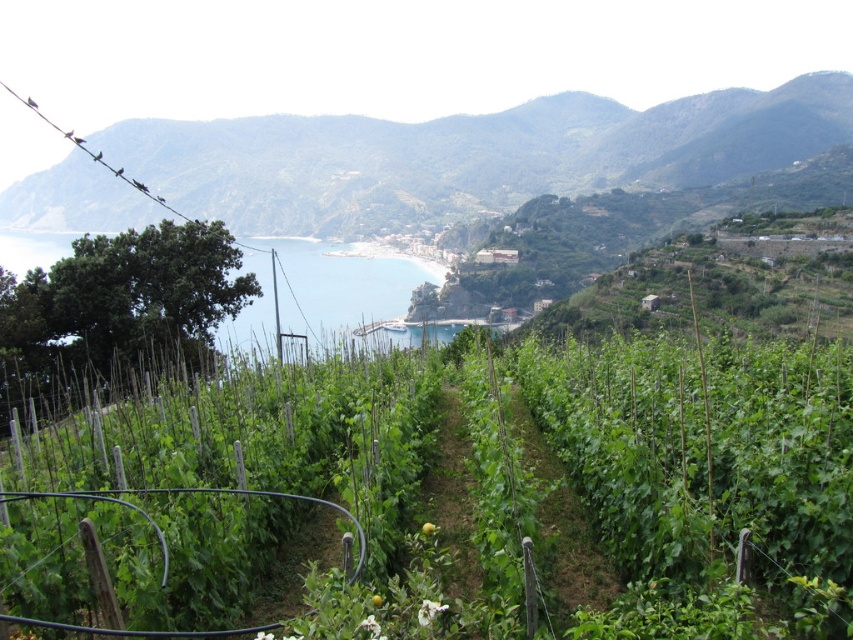
You are a tourist standing at the edge of the vineyard and looking towards the coast. You see the green leafy vines at center and the blue water at center. Which object is closer to your feet?

The green leafy vines at center are closer to your feet because they are located below the blue water at center, indicating they are in the foreground of the scene.

In the scene shown: You are standing on the beach and looking towards the green leafy hillside at upper center and the blue water at center. Which object is located higher in the image?

The green leafy hillside at upper center is positioned over the blue water at center, so it is higher in the image.